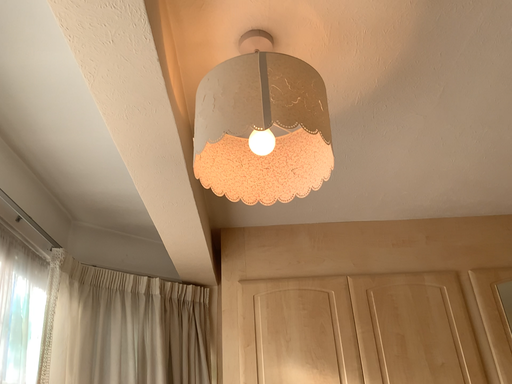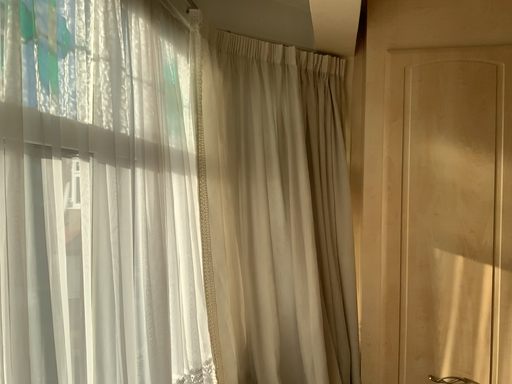
Question: Which way did the camera rotate in the video?

Choices:
 (A) rotated left
 (B) rotated right

Answer: (A)